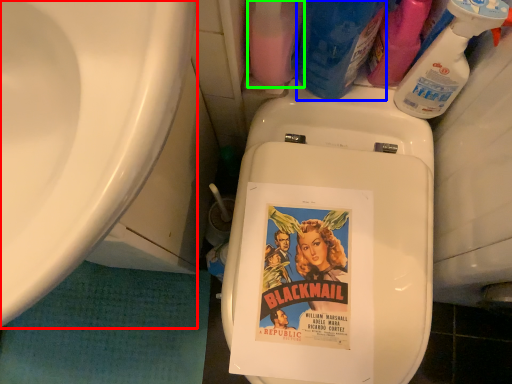
Question: Estimate the real-world distances between objects in this image. Which object is farther from sink (highlighted by a red box), cleaning product (highlighted by a blue box) or cleaning product (highlighted by a green box)?

Choices:
 (A) cleaning product
 (B) cleaning product

Answer: (A)